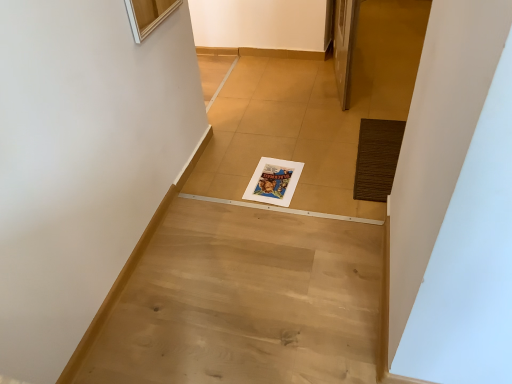
Locate an element on the screen. The height and width of the screenshot is (384, 512). free space above brown textured mat at right (from a real-world perspective) is located at coordinates pos(380,150).